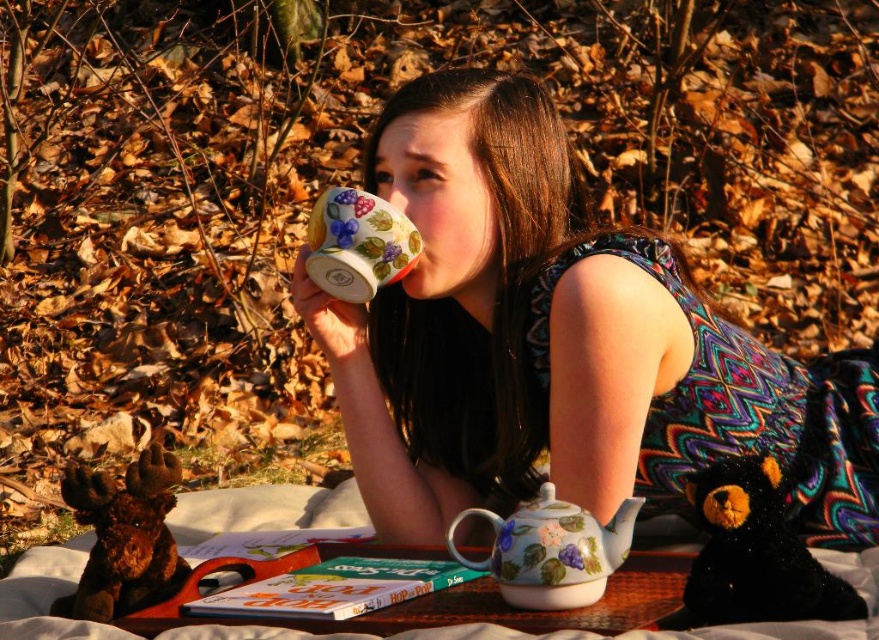
Can you confirm if floral ceramic mug at upper center is positioned to the left of floral porcelain teapot at lower center?

In fact, floral ceramic mug at upper center is to the right of floral porcelain teapot at lower center.

Who is lower down, floral ceramic mug at upper center or floral porcelain teapot at lower center?

floral porcelain teapot at lower center is lower down.

Is point (527, 401) positioned after point (631, 540)?

That is True.

At what (x,y) coordinates should I click in order to perform the action: click on floral ceramic mug at upper center. Please return your answer as a coordinate pair (x, y). This screenshot has width=879, height=640. Looking at the image, I should click on (560, 342).

Can you confirm if floral ceramic mug at upper center is positioned to the right of porcelain floral cup at upper center?

Yes, floral ceramic mug at upper center is to the right of porcelain floral cup at upper center.

Does floral ceramic mug at upper center have a greater width compared to porcelain floral cup at upper center?

Correct, the width of floral ceramic mug at upper center exceeds that of porcelain floral cup at upper center.

Is point (367, 369) in front of point (394, 253)?

That is False.

Where is `floral ceramic mug at upper center`? The image size is (879, 640). floral ceramic mug at upper center is located at coordinates (560, 342).

The image size is (879, 640). Identify the location of floral ceramic mug at upper center. (560, 342).

Is floral ceramic mug at upper center taller than black plush bear at lower right?

Indeed, floral ceramic mug at upper center has a greater height compared to black plush bear at lower right.

Who is more forward, (569, 413) or (781, 579)?

Point (781, 579)

You are a GUI agent. You are given a task and a screenshot of the screen. Output one action in this format:
    pyautogui.click(x=<x>, y=<y>)
    Task: Click on the floral ceramic mug at upper center
    
    Given the screenshot: What is the action you would take?
    pyautogui.click(x=560, y=342)